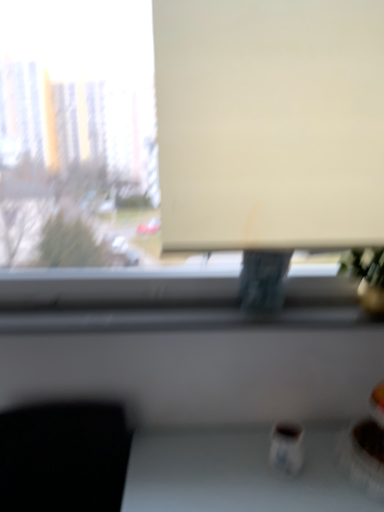
Question: Based on their sizes in the image, would you say white matte window at upper center is bigger or smaller than matte white screen at center?

Choices:
 (A) big
 (B) small

Answer: (A)

Question: Is white matte window at upper center inside the boundaries of matte white screen at center, or outside?

Choices:
 (A) outside
 (B) inside

Answer: (A)

Question: Considering their positions, is white matte window at upper center located in front of or behind matte white screen at center?

Choices:
 (A) front
 (B) behind

Answer: (A)

Question: Is matte white screen at center situated inside white matte window at upper center or outside?

Choices:
 (A) inside
 (B) outside

Answer: (A)

Question: Visually, is matte white screen at center positioned to the left or to the right of white matte window at upper center?

Choices:
 (A) left
 (B) right

Answer: (B)

Question: From their relative heights in the image, would you say matte white screen at center is taller or shorter than white matte window at upper center?

Choices:
 (A) short
 (B) tall

Answer: (A)

Question: From a real-world perspective, is matte white screen at center physically located above or below white matte window at upper center?

Choices:
 (A) above
 (B) below

Answer: (A)